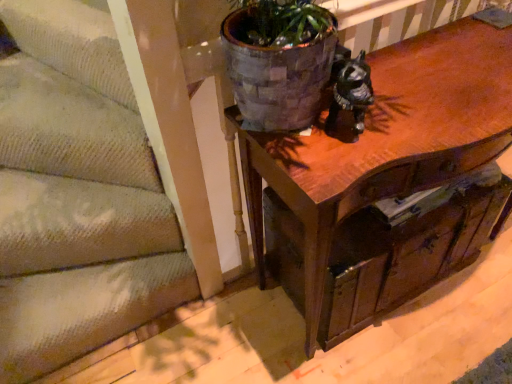
Question: From the image's perspective, is wooden drawer at center located above or below wooden table at center?

Choices:
 (A) above
 (B) below

Answer: (B)

Question: Is wooden drawer at center bigger or smaller than wooden table at center?

Choices:
 (A) small
 (B) big

Answer: (A)

Question: Which object is the farthest from the textured beige carpet at lower left?

Choices:
 (A) wooden drawer at center
 (B) wooden table at center

Answer: (A)

Question: Which object is the closest to the wooden drawer at center?

Choices:
 (A) wooden table at center
 (B) textured beige carpet at lower left

Answer: (A)